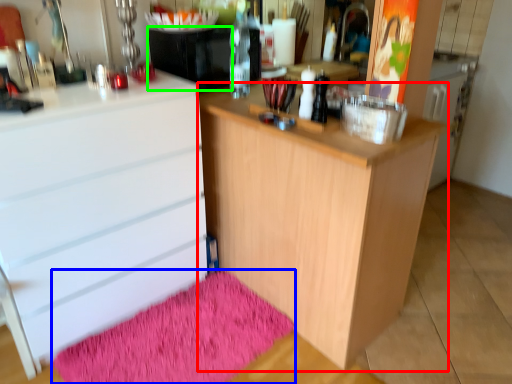
Question: Which object is positioned farthest from cupboard (highlighted by a red box)? Select from bath mat (highlighted by a blue box) and appliance (highlighted by a green box).

Choices:
 (A) bath mat
 (B) appliance

Answer: (B)